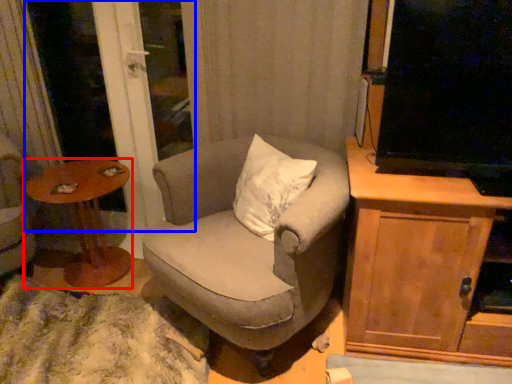
Question: Among these objects, which one is farthest to the camera, table (highlighted by a red box) or screen door (highlighted by a blue box)?

Choices:
 (A) table
 (B) screen door

Answer: (B)